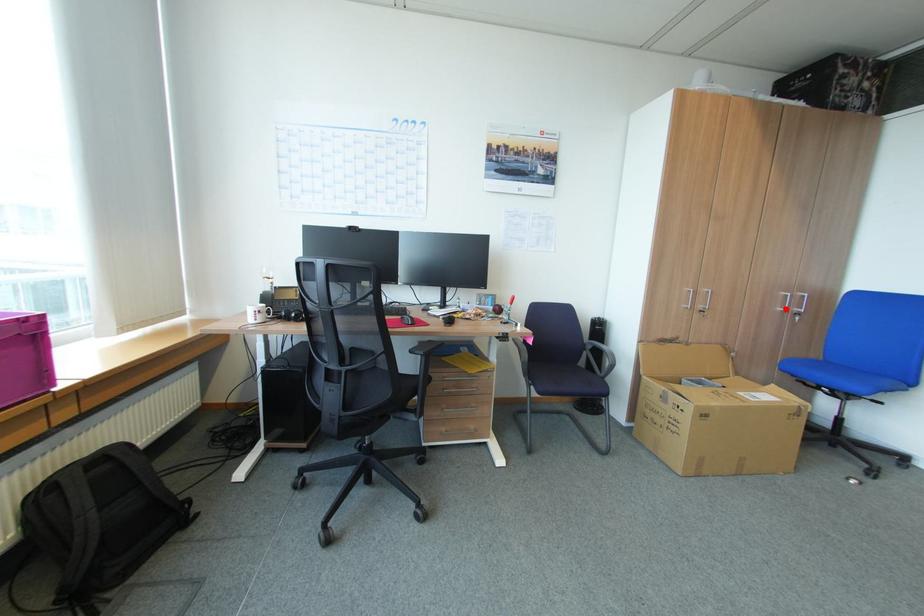
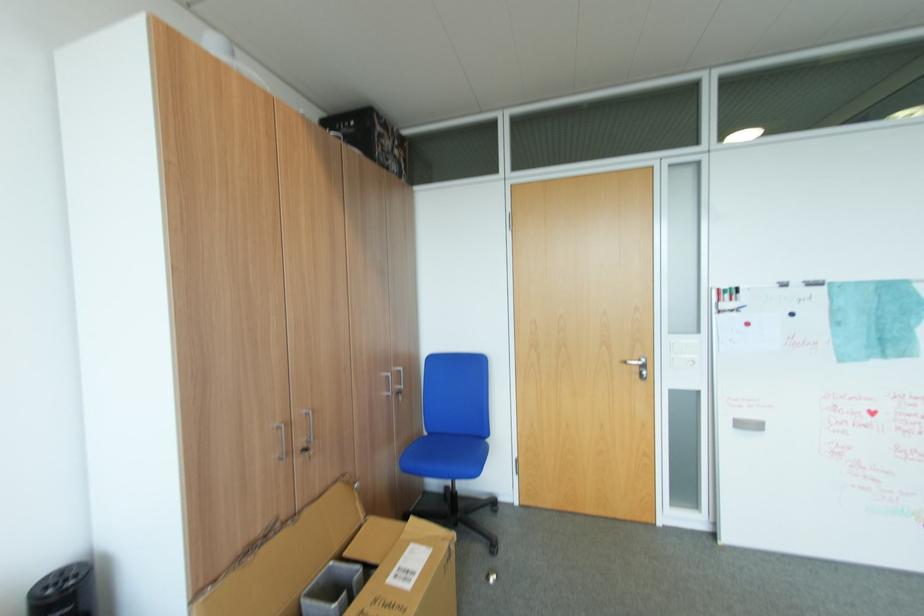
Find the pixel in the second image that matches the highlighted location in the first image.

(390, 394)